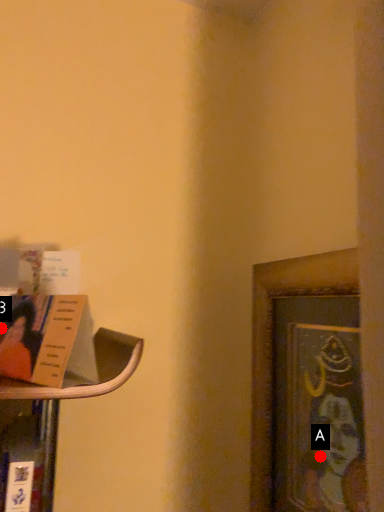
Question: Two points are circled on the image, labeled by A and B beside each circle. Which point is further to the camera?

Choices:
 (A) A is further
 (B) B is further

Answer: (A)